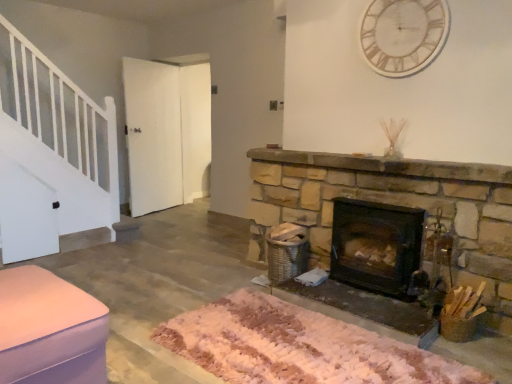
Question: Is pink fabric ottoman at lower left to the left or to the right of dark brown stone wood burning stove at center right in the image?

Choices:
 (A) right
 (B) left

Answer: (B)

Question: Is pink fabric ottoman at lower left bigger or smaller than dark brown stone wood burning stove at center right?

Choices:
 (A) small
 (B) big

Answer: (B)

Question: Based on their relative distances, which object is farther from the pink fabric ottoman at lower left?

Choices:
 (A) white fluffy mat at center
 (B) white marble clock at upper center
 (C) dark brown stone wood burning stove at center right

Answer: (B)

Question: Estimate the real-world distances between objects in this image. Which object is closer to the dark brown stone wood burning stove at center right?

Choices:
 (A) pink fabric ottoman at lower left
 (B) white fluffy mat at center
 (C) white marble clock at upper center

Answer: (B)